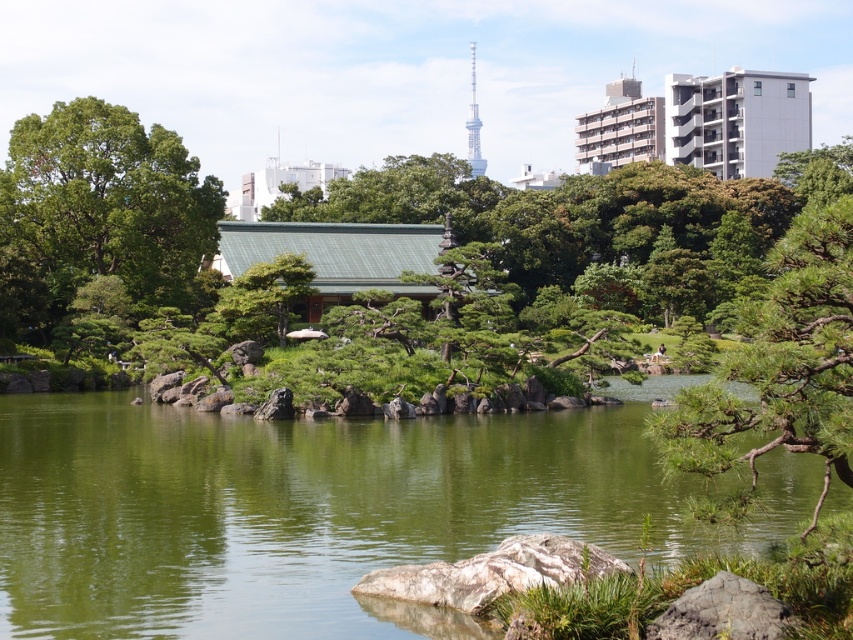
Question: Estimate the real-world distances between objects in this image. Which object is farther from the green leafy tree at upper left?

Choices:
 (A) green textured tree at center
 (B) gray rough rock at lower center
 (C) green textured pine tree at center-right

Answer: (B)

Question: Which object is closer to the camera taking this photo?

Choices:
 (A) green textured tree at center
 (B) green textured pine tree at center-right
 (C) gray rough stone at lower right

Answer: (B)

Question: Does green leafy tree at upper left appear on the left side of gray rough rock at lower center?

Choices:
 (A) yes
 (B) no

Answer: (A)

Question: Which point is farther to the camera?

Choices:
 (A) (726, 621)
 (B) (165, 264)
 (C) (679, 522)

Answer: (B)

Question: Where is green leafy tree at upper left located in relation to green textured tree at center in the image?

Choices:
 (A) right
 (B) left

Answer: (B)

Question: Is green smooth water at center wider than gray rough stone at lower right?

Choices:
 (A) yes
 (B) no

Answer: (A)